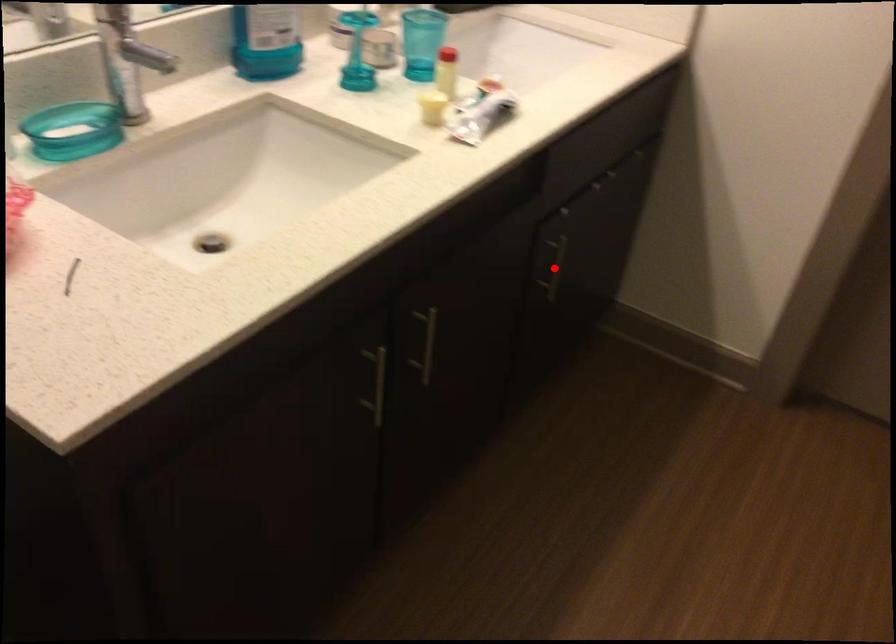
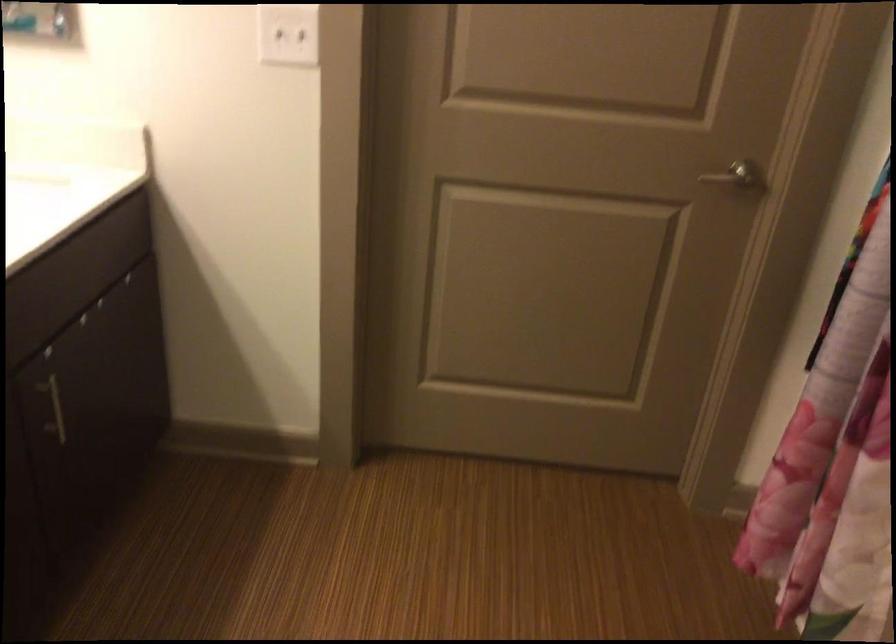
In the second image, find the point that corresponds to the highlighted location in the first image.

(54, 409)